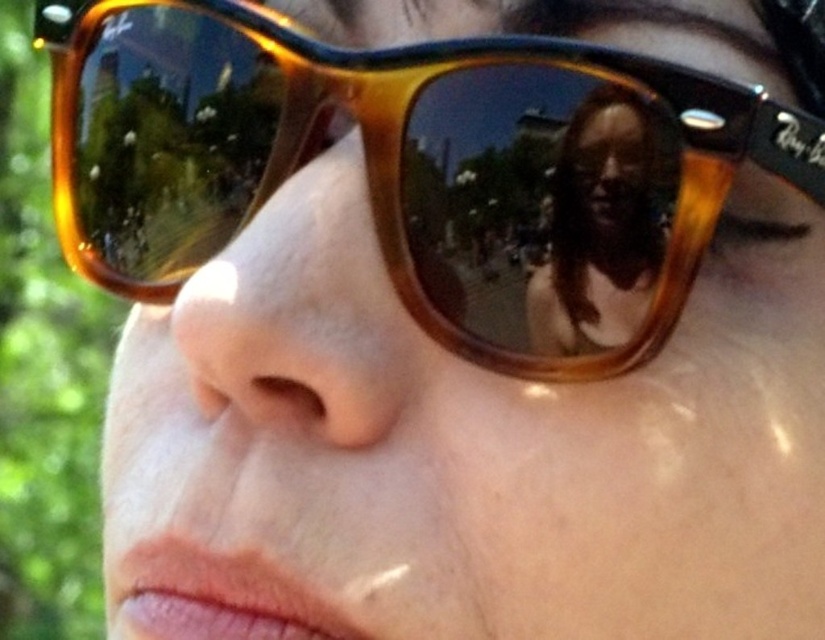
Question: Which object appears farthest from the camera in this image?

Choices:
 (A) matte brown hair at center
 (B) tortoiseshell sunglasses at center

Answer: (A)

Question: Is tortoiseshell sunglasses at center wider than matte brown hair at center?

Choices:
 (A) no
 (B) yes

Answer: (B)

Question: Is tortoiseshell sunglasses at center above matte brown hair at center?

Choices:
 (A) no
 (B) yes

Answer: (B)

Question: Does tortoiseshell sunglasses at center appear under matte brown hair at center?

Choices:
 (A) yes
 (B) no

Answer: (B)